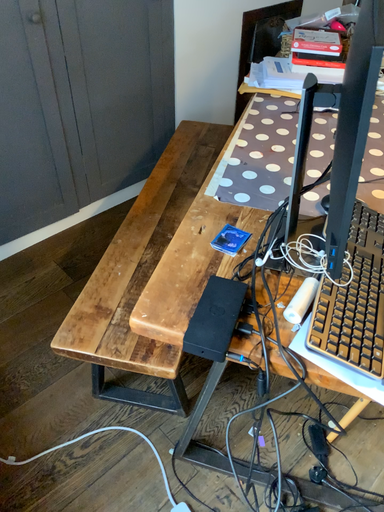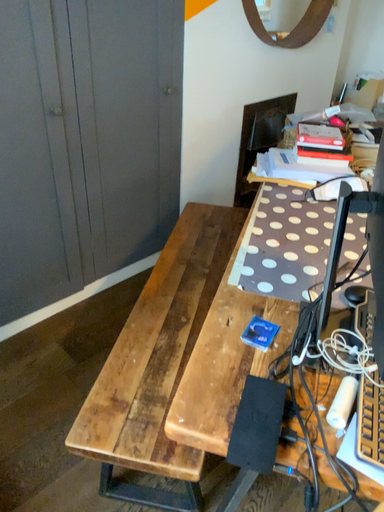
Question: How did the camera likely rotate when shooting the video?

Choices:
 (A) rotated downward
 (B) rotated upward

Answer: (B)